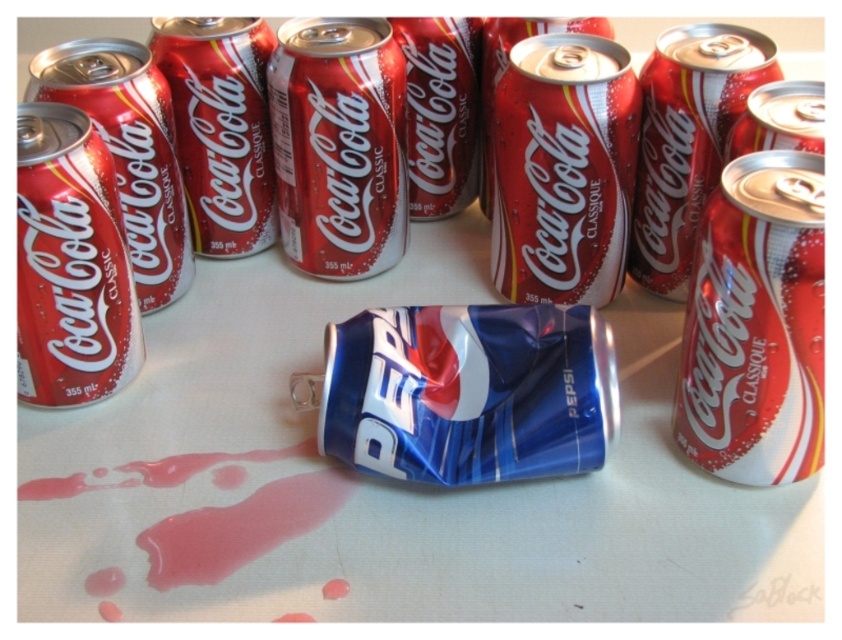
Can you confirm if blue metallic pepsi can at center is smaller than shiny metallic can at center?

No, blue metallic pepsi can at center is not smaller than shiny metallic can at center.

Between blue metallic pepsi can at center and shiny metallic can at center, which one appears on the right side from the viewer's perspective?

From the viewer's perspective, blue metallic pepsi can at center appears more on the right side.

What do you see at coordinates (344, 467) in the screenshot? This screenshot has width=842, height=640. I see `blue metallic pepsi can at center` at bounding box center [344, 467].

In order to click on blue metallic pepsi can at center in this screenshot , I will do `click(344, 467)`.

Does shiny metallic can at upper right come in front of matte red coca-cola can at left?

Yes.

Can you confirm if shiny metallic can at upper right is positioned above matte red coca-cola can at left?

No.

Find the location of a particular element. The image size is (842, 640). shiny metallic can at upper right is located at coordinates (755, 324).

Who is more forward, (259,358) or (771,227)?

Point (771,227) is in front.

Does blue metallic pepsi can at center come in front of shiny metallic can at upper right?

That is False.

Locate an element on the screen. This screenshot has width=842, height=640. blue metallic pepsi can at center is located at coordinates (344, 467).